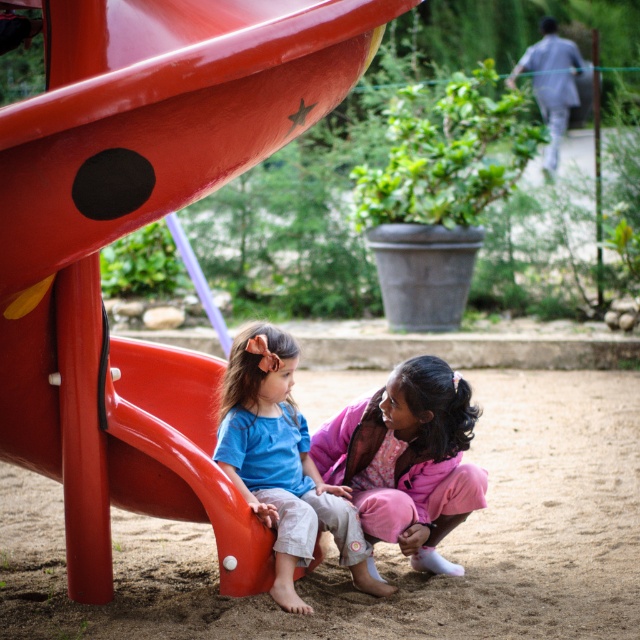
Is the position of pink fabric dress at lower center more distant than that of blue cotton shirt at lower left?

Yes, pink fabric dress at lower center is further from the viewer.

Is point (429, 417) positioned behind point (250, 410)?

That is False.

Does point (388, 413) come farther from viewer compared to point (282, 548)?

Yes.

Find the location of a particular element. This screenshot has height=640, width=640. pink fabric dress at lower center is located at coordinates (406, 460).

In the scene shown: Which is more to the right, smooth plastic slide at center or pink fabric dress at lower center?

Positioned to the right is pink fabric dress at lower center.

Can you confirm if smooth plastic slide at center is taller than pink fabric dress at lower center?

Correct, smooth plastic slide at center is much taller as pink fabric dress at lower center.

Image resolution: width=640 pixels, height=640 pixels. Describe the element at coordinates (136, 227) in the screenshot. I see `smooth plastic slide at center` at that location.

Identify the location of smooth plastic slide at center. (136, 227).

Does point (282, 109) come behind point (362, 554)?

No, it is in front of (362, 554).

Does point (310, 24) come in front of point (305, 458)?

Yes, it is.

Is point (170, 369) in front of point (340, 561)?

No, (170, 369) is further to viewer.

Identify the location of smooth plastic slide at center. (136, 227).